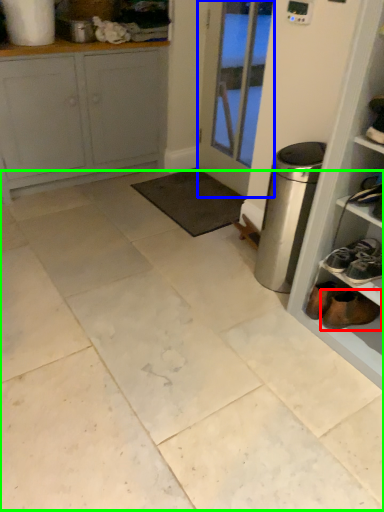
Question: Which object is the farthest from footwear (highlighted by a red box)? Choose among these: door (highlighted by a blue box) or ceramic tile (highlighted by a green box).

Choices:
 (A) door
 (B) ceramic tile

Answer: (A)